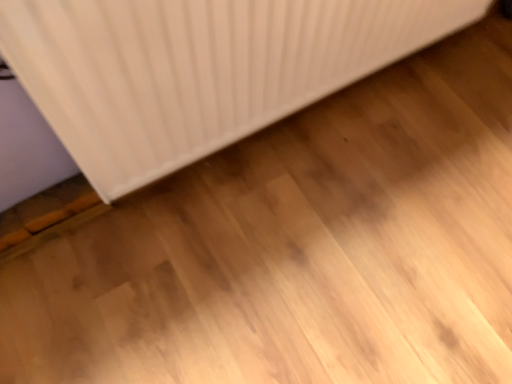
This screenshot has height=384, width=512. Describe the element at coordinates (198, 69) in the screenshot. I see `white matte radiator at upper left` at that location.

This screenshot has height=384, width=512. I want to click on white matte radiator at upper left, so click(x=198, y=69).

This screenshot has height=384, width=512. What are the coordinates of `white matte radiator at upper left` in the screenshot? It's located at (198, 69).